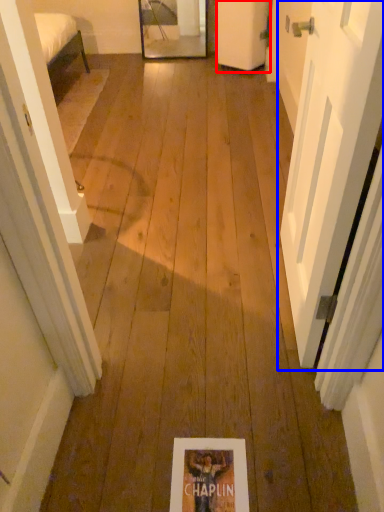
Question: Which point is closer to the camera, door (highlighted by a red box) or door (highlighted by a blue box)?

Choices:
 (A) door
 (B) door

Answer: (B)